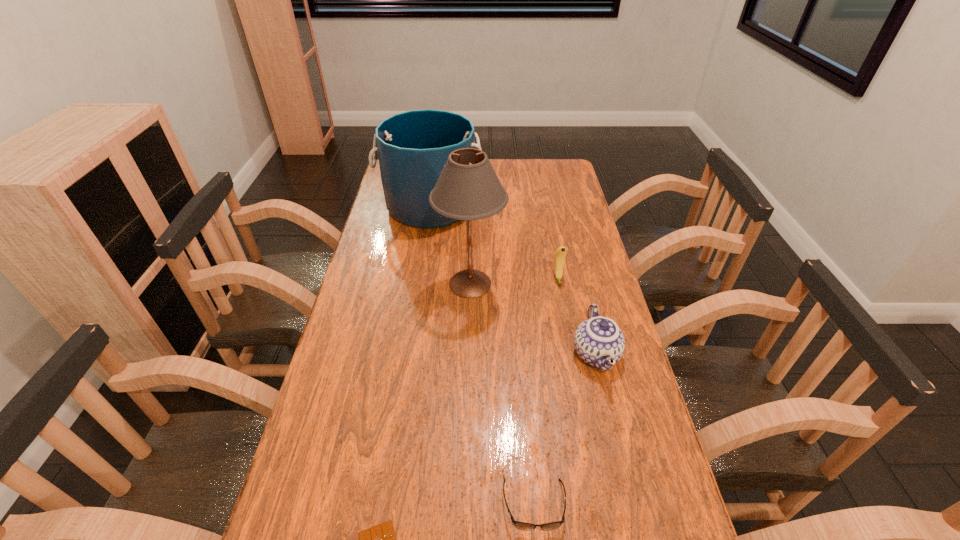
Where is `the closest object to the farthest object`? The width and height of the screenshot is (960, 540). the closest object to the farthest object is located at coordinates (468, 188).